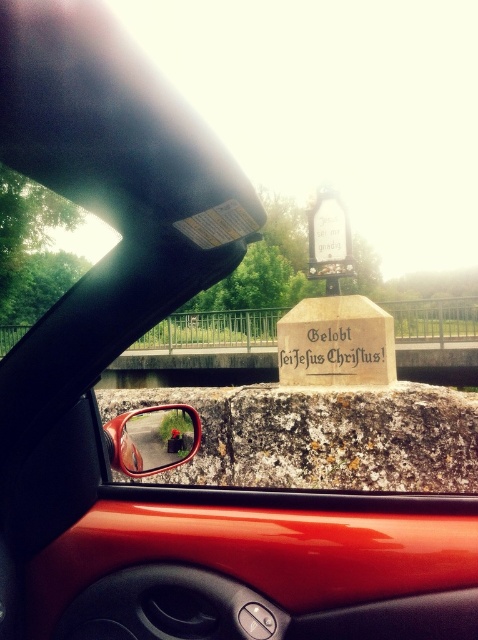
Question: From the image, what is the correct spatial relationship of gold metallic stone at center in relation to glossy plastic rearview mirror at lower left?

Choices:
 (A) below
 (B) above

Answer: (B)

Question: Which point appears closest to the camera in this image?

Choices:
 (A) (159, 470)
 (B) (304, 362)

Answer: (A)

Question: Does gold metallic stone at center appear on the left side of glossy plastic rearview mirror at lower left?

Choices:
 (A) yes
 (B) no

Answer: (B)

Question: Can you confirm if gold metallic stone at center is thinner than glossy plastic rearview mirror at lower left?

Choices:
 (A) no
 (B) yes

Answer: (A)